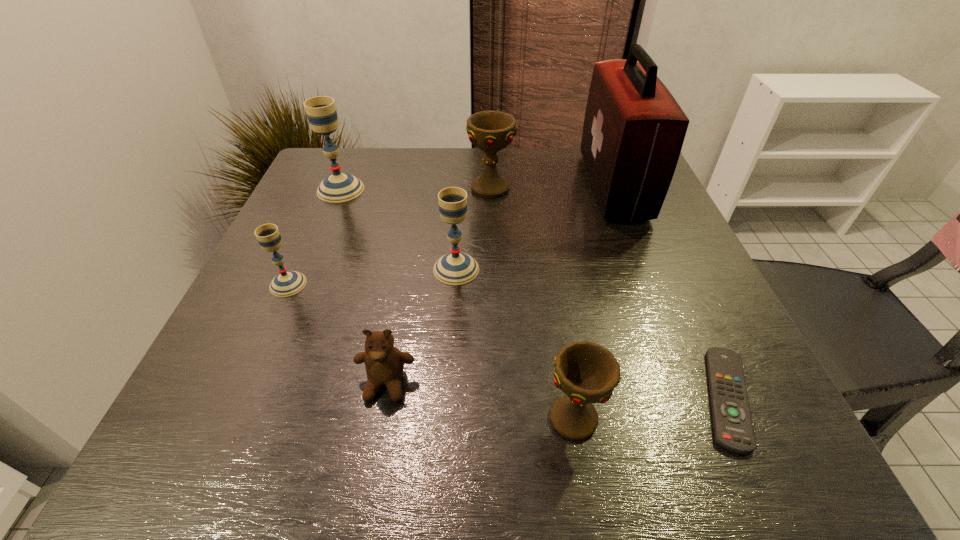
Identify the location of the second closest gray chalice relative to the third object from right to left. The width and height of the screenshot is (960, 540). (287, 283).

Locate which gray chalice is the closest to the nearest chalice. Please provide its 2D coordinates. Your answer should be formatted as a tuple, i.e. [(x, y)], where the tuple contains the x and y coordinates of a point satisfying the conditions above.

[(455, 268)]

At what (x,y) coordinates should I click in order to perform the action: click on vacant position in the image that satisfies the following two spatial constraints: 1. on the side of the red first aid kit with the cross symbol; 2. on the front side of the second smallest gray chalice. Please return your answer as a coordinate pair (x, y). Looking at the image, I should click on (647, 269).

Where is `vacant region that satisfies the following two spatial constraints: 1. on the back side of the second smallest gray chalice; 2. on the right side of the farther red chalice`? vacant region that satisfies the following two spatial constraints: 1. on the back side of the second smallest gray chalice; 2. on the right side of the farther red chalice is located at coordinates (461, 188).

Locate an element on the screen. Image resolution: width=960 pixels, height=540 pixels. vacant area that satisfies the following two spatial constraints: 1. on the back side of the nearest chalice; 2. on the right side of the remote control is located at coordinates (570, 399).